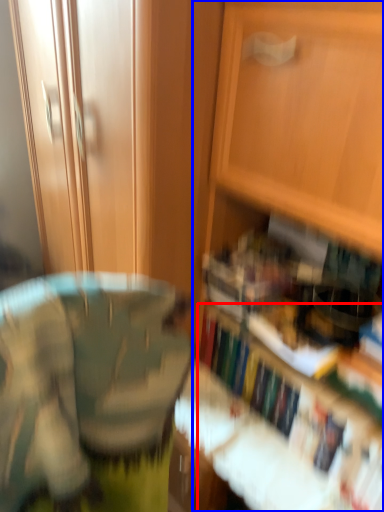
Question: Which point is further to the camera, book (highlighted by a red box) or cabinetry (highlighted by a blue box)?

Choices:
 (A) book
 (B) cabinetry

Answer: (A)